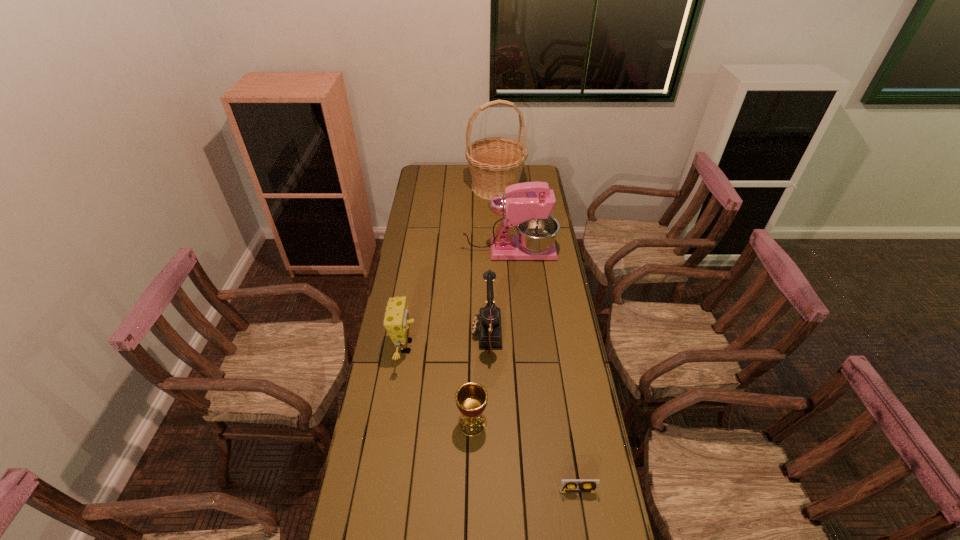
What are the coordinates of `basket that is at the right edge` in the screenshot? It's located at point(495,163).

Locate an element on the screen. Image resolution: width=960 pixels, height=540 pixels. mixer that is at the right edge is located at coordinates pos(528,206).

Where is `videotape that is at the right edge`? The image size is (960, 540). videotape that is at the right edge is located at coordinates (567, 485).

What are the coordinates of `object positioned at the far right corner` in the screenshot? It's located at (495, 163).

In the image, there is a desktop. Find the location of `vacant space at the left edge`. vacant space at the left edge is located at coordinates (398, 433).

I want to click on vacant space at the right edge of the desktop, so click(x=595, y=501).

You are a GUI agent. You are given a task and a screenshot of the screen. Output one action in this format:
    pyautogui.click(x=<x>, y=<y>)
    Task: Click on the blank area at the far left corner
    This screenshot has height=540, width=960.
    Given the screenshot: What is the action you would take?
    pyautogui.click(x=439, y=174)

What are the coordinates of `free space between the fifth farthest object and the nearest object` in the screenshot? It's located at (525, 457).

The width and height of the screenshot is (960, 540). What are the coordinates of `unoccupied area between the tallest object and the second nearest object` in the screenshot? It's located at (484, 305).

You are a GUI agent. You are given a task and a screenshot of the screen. Output one action in this format:
    pyautogui.click(x=<x>, y=<y>)
    Task: Click on the free space between the farthest object and the chalice
    
    Given the screenshot: What is the action you would take?
    pyautogui.click(x=484, y=305)